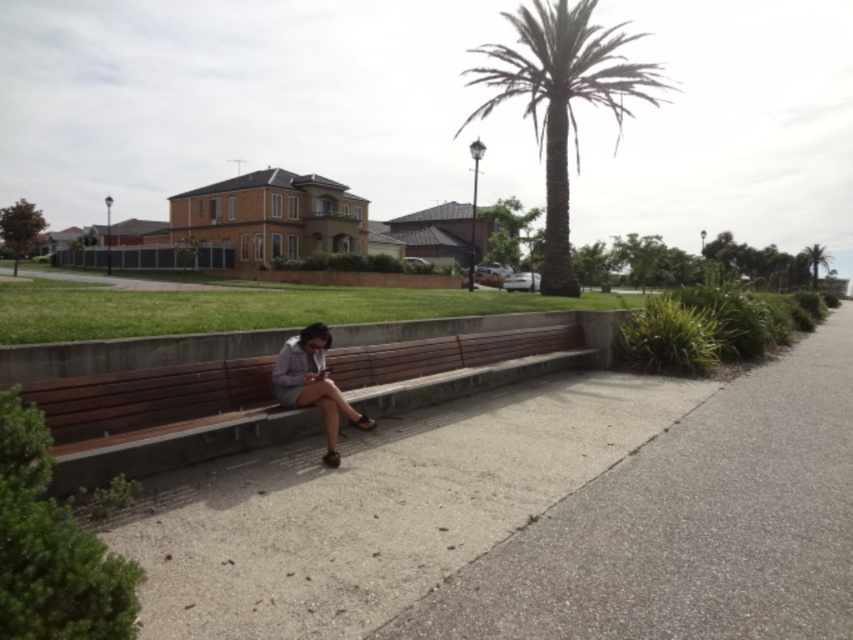
Question: Can you confirm if green leafy palm tree at upper center is positioned to the right of green leafy palm tree at upper right?

Choices:
 (A) no
 (B) yes

Answer: (A)

Question: Which point is farther to the camera?

Choices:
 (A) (816, 280)
 (B) (811, 568)

Answer: (A)

Question: Which point is farther from the camera taking this photo?

Choices:
 (A) (815, 273)
 (B) (556, 179)
 (C) (430, 371)
 (D) (291, 364)

Answer: (A)

Question: Estimate the real-world distances between objects in this image. Which object is farther from the matte gray shirt at center?

Choices:
 (A) gray concrete pavement at center
 (B) green leafy palm tree at upper center

Answer: (B)

Question: Can you confirm if brown wooden bench at center is positioned above green leafy palm tree at upper center?

Choices:
 (A) no
 (B) yes

Answer: (A)

Question: Does brown wooden bench at center appear over matte gray shirt at center?

Choices:
 (A) no
 (B) yes

Answer: (B)